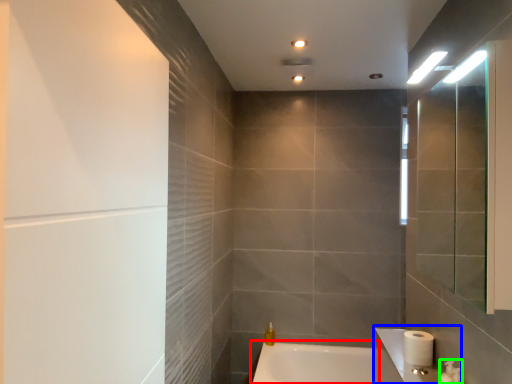
Question: Considering the real-world distances, which object is closest to bathtub (highlighted by a red box)? sink (highlighted by a blue box) or plumbing fixture (highlighted by a green box).

Choices:
 (A) sink
 (B) plumbing fixture

Answer: (A)